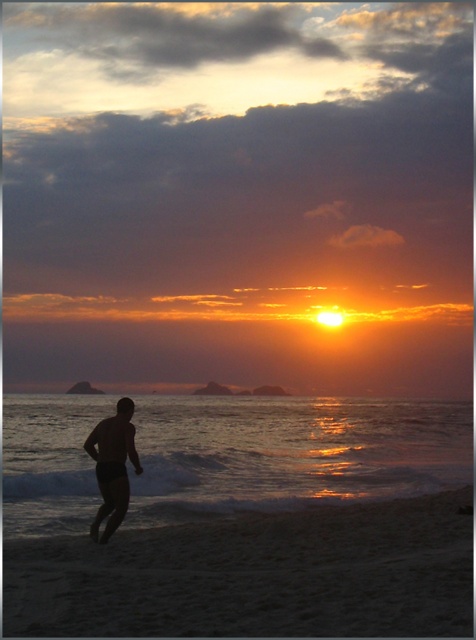
Which is above, sandy beach at lower center or black matte/silhouette man at lower left?

black matte/silhouette man at lower left is above.

Which is in front, point (367, 616) or point (122, 497)?

Point (367, 616) is in front.

Is point (128, 548) closer to viewer compared to point (109, 474)?

Yes.

What are the coordinates of `sandy beach at lower center` in the screenshot? It's located at coord(256,573).